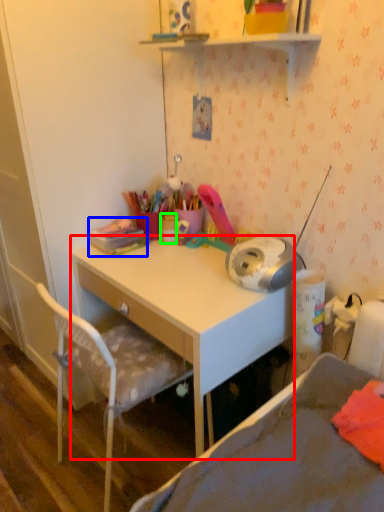
Question: Which object is the closest to the desk (highlighted by a red box)? Choose among these: stationery (highlighted by a blue box) or stationery (highlighted by a green box).

Choices:
 (A) stationery
 (B) stationery

Answer: (A)